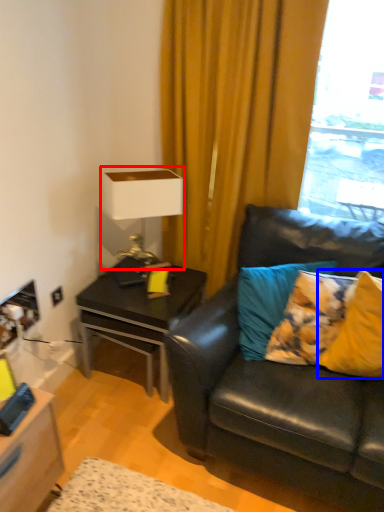
Question: Which point is further to the camera, table lamp (highlighted by a red box) or pillow (highlighted by a blue box)?

Choices:
 (A) table lamp
 (B) pillow

Answer: (A)